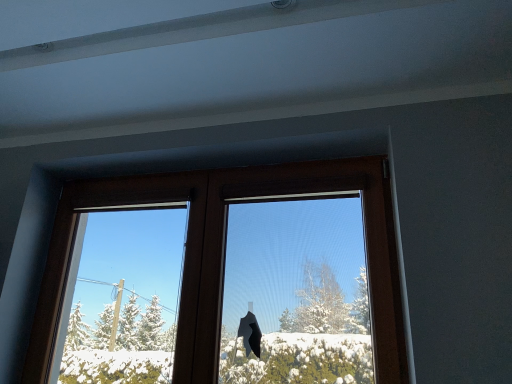
Image resolution: width=512 pixels, height=384 pixels. Describe the element at coordinates (225, 250) in the screenshot. I see `brown wooden window at center` at that location.

You are a GUI agent. You are given a task and a screenshot of the screen. Output one action in this format:
    pyautogui.click(x=<x>, y=<y>)
    Task: Click on the brown wooden window at center
    The image size is (512, 384).
    Given the screenshot: What is the action you would take?
    pyautogui.click(x=225, y=250)

Locate an element on the screen. The height and width of the screenshot is (384, 512). brown wooden window at center is located at coordinates (225, 250).